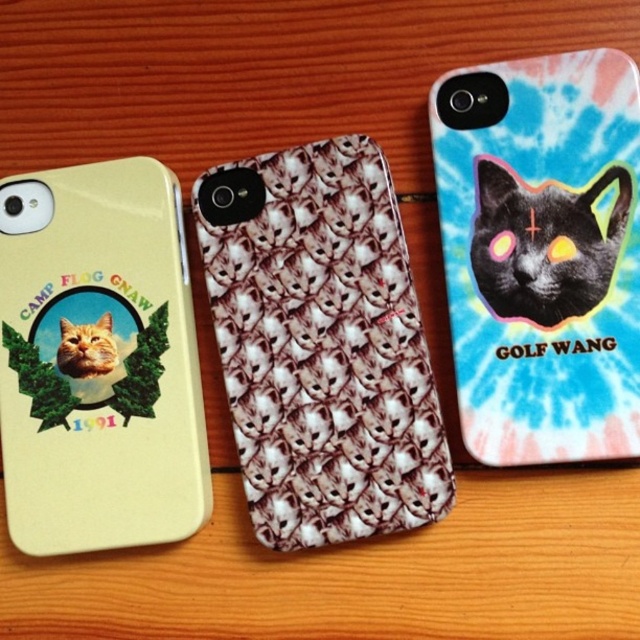
What is the position of the point with coordinates (321, 346) in relation to the white textured cats at center?

The point with coordinates (321, 346) is located on the white textured cats at center.

Looking at this image, you are trying to place a new phone case between the white textured cats at center and the matte yellow phone case at left. The new case is 3 inches wide. Will it fit in the space between them?

The distance between the white textured cats at center and the matte yellow phone case at left is 7.32 inches. Since the new case is only 3 inches wide, it will fit comfortably in the space between them.